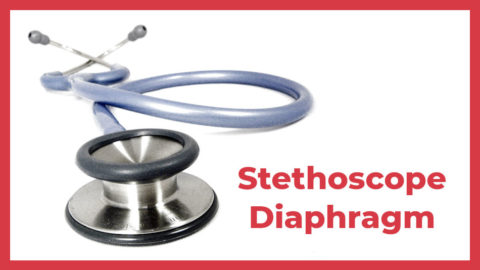
Identify the location of reflection from lighting. (168, 108), (242, 113), (177, 77), (216, 73), (120, 144), (133, 222).